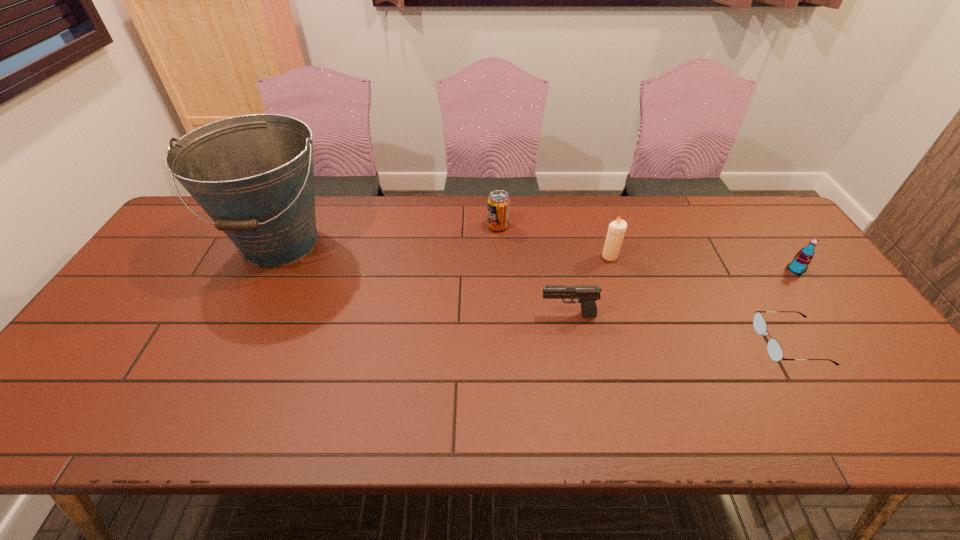
This screenshot has height=540, width=960. Find the location of `the nearest object`. the nearest object is located at coordinates (775, 351).

Identify the location of the second object from right to left. The image size is (960, 540). (775, 351).

At what (x,y) coordinates should I click in order to perform the action: click on vacant space situated 0.380m with the handle on opposite sides of the tallest object. Please return your answer as a coordinate pair (x, y). The width and height of the screenshot is (960, 540). Looking at the image, I should click on (201, 408).

The image size is (960, 540). Find the location of `free space located 0.270m on the front of the candle`. free space located 0.270m on the front of the candle is located at coordinates (x=635, y=335).

You are a GUI agent. You are given a task and a screenshot of the screen. Output one action in this format:
    pyautogui.click(x=<x>, y=<y>)
    Task: Click on the blank space located on the left of the farther soda
    
    Given the screenshot: What is the action you would take?
    pyautogui.click(x=391, y=226)

This screenshot has height=540, width=960. Identify the location of free space located 0.130m on the front of the nearer soda. (826, 311).

At what (x,y) coordinates should I click in order to perform the action: click on vacant space located aim along the barrel of the pistol. Please return your answer as a coordinate pair (x, y). Looking at the image, I should click on click(x=456, y=315).

Image resolution: width=960 pixels, height=540 pixels. Find the location of `free space located aim along the barrel of the pistol`. free space located aim along the barrel of the pistol is located at coordinates (448, 315).

This screenshot has width=960, height=540. Find the location of `free point located 0.380m aim along the barrel of the pistol`. free point located 0.380m aim along the barrel of the pistol is located at coordinates (395, 315).

Find the location of a particular element. The image size is (960, 540). vacant area situated 0.150m on the lenses of the nearest object is located at coordinates (701, 343).